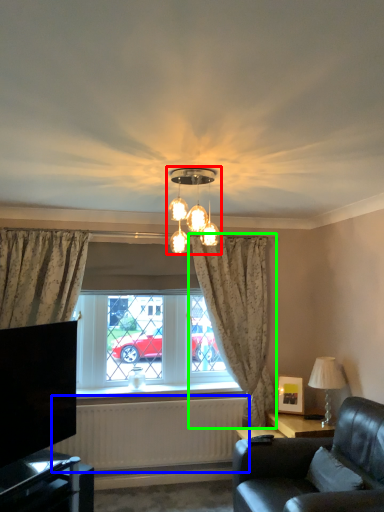
Question: Considering the real-world distances, which object is farthest from lamp (highlighted by a red box)? radiator (highlighted by a blue box) or curtain (highlighted by a green box)?

Choices:
 (A) radiator
 (B) curtain

Answer: (A)